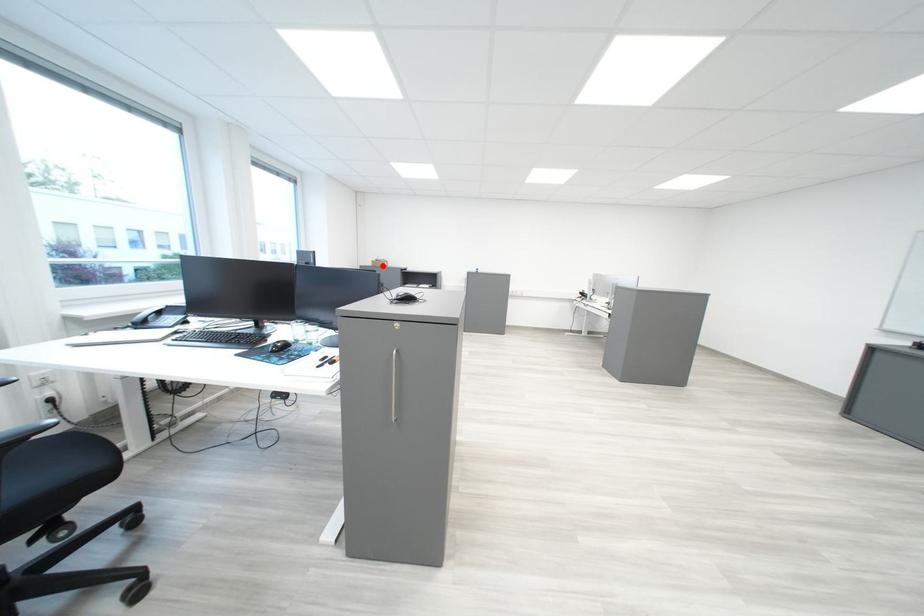
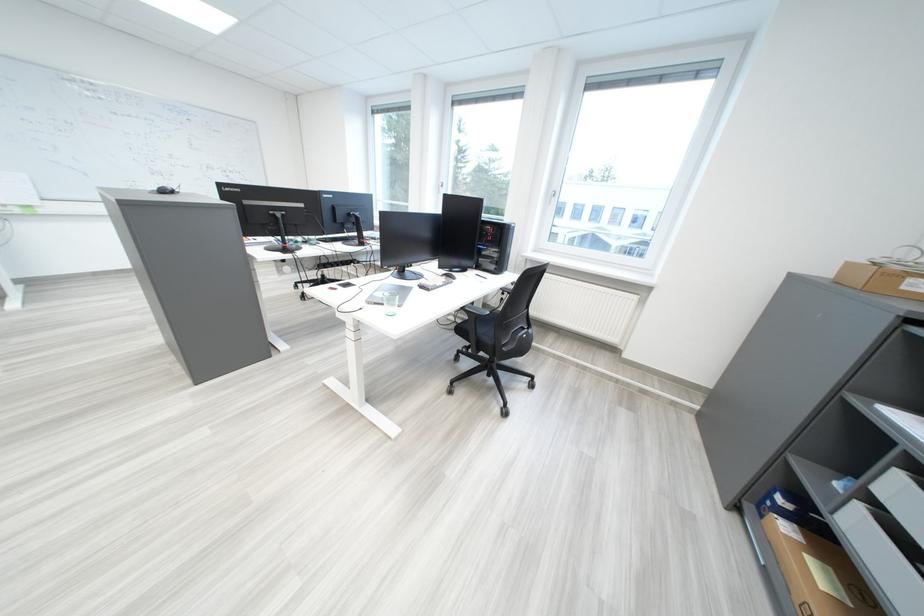
Find the pixel in the second image that matches the highlighted location in the first image.

(839, 274)